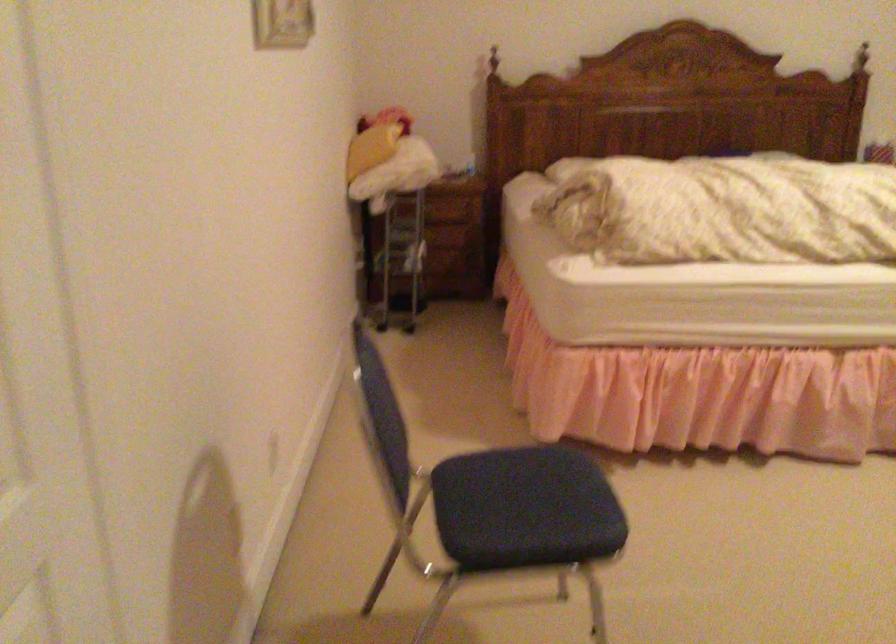
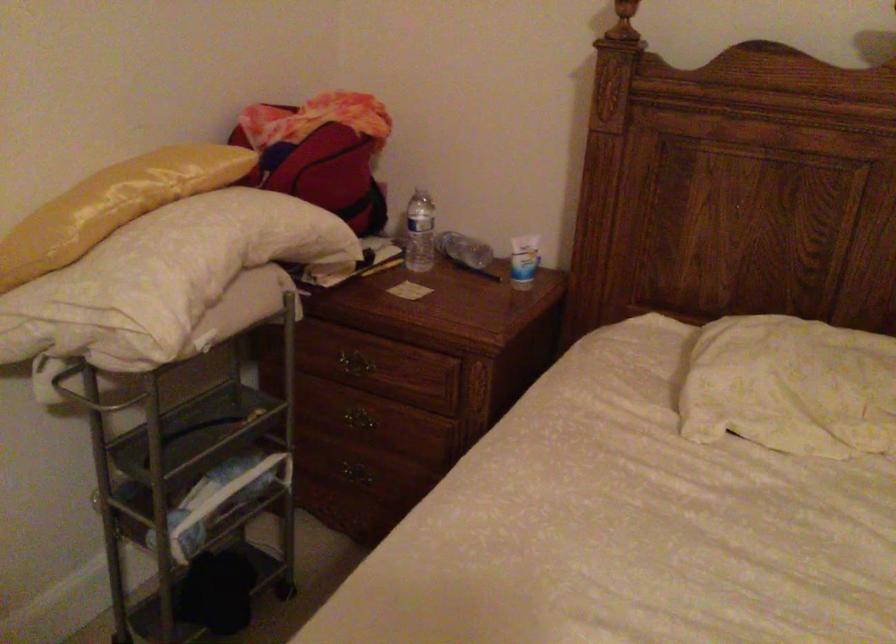
Where in the second image is the point corresponding to (385,133) from the first image?

(113, 205)